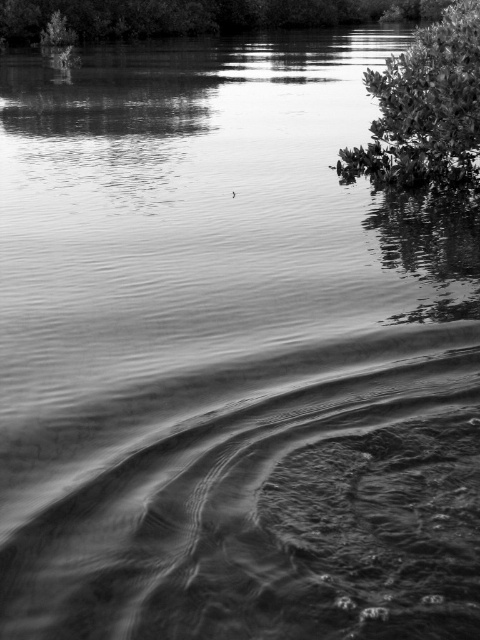
You are a photographer aiming to capture the reflection of the green leafy tree at upper right and the smooth green foliage at upper center in the water. Which object will have a smaller reflection in the water?

The green leafy tree at upper right is not as tall as the smooth green foliage at upper center, so its reflection will be smaller.

You are standing at the edge of the water in the scene. Which object, the green leafy tree at upper right or the smooth green foliage at upper center, would appear larger to you?

The green leafy tree at upper right is closer to the viewer than the smooth green foliage at upper center, so it would appear larger.